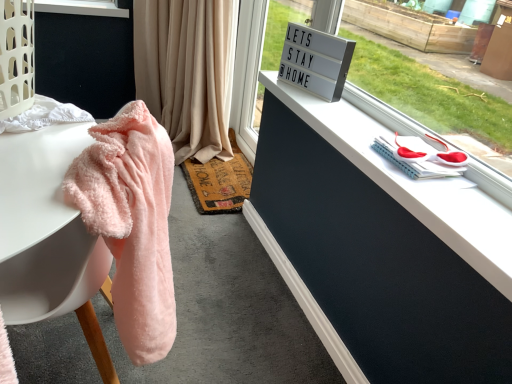
Question: Does white plastic sign at upper center lie in front of white matte dresser at upper right?

Choices:
 (A) yes
 (B) no

Answer: (B)

Question: Does white plastic sign at upper center appear on the right side of white matte dresser at upper right?

Choices:
 (A) yes
 (B) no

Answer: (B)

Question: Is white plastic sign at upper center wider than white matte dresser at upper right?

Choices:
 (A) yes
 (B) no

Answer: (B)

Question: From a real-world perspective, is white plastic sign at upper center positioned over white matte dresser at upper right based on gravity?

Choices:
 (A) yes
 (B) no

Answer: (B)

Question: Is white plastic sign at upper center next to white matte dresser at upper right and touching it?

Choices:
 (A) yes
 (B) no

Answer: (B)

Question: Can you confirm if white plastic sign at upper center is shorter than white matte dresser at upper right?

Choices:
 (A) no
 (B) yes

Answer: (A)

Question: From a real-world perspective, is white plastic sign at upper center positioned under rustic woven mat at center based on gravity?

Choices:
 (A) no
 (B) yes

Answer: (A)

Question: Can you confirm if white plastic sign at upper center is wider than rustic woven mat at center?

Choices:
 (A) yes
 (B) no

Answer: (B)

Question: Is white plastic sign at upper center oriented away from rustic woven mat at center?

Choices:
 (A) no
 (B) yes

Answer: (A)

Question: Is white plastic sign at upper center to the left of rustic woven mat at center from the viewer's perspective?

Choices:
 (A) yes
 (B) no

Answer: (B)

Question: Does white plastic sign at upper center come in front of rustic woven mat at center?

Choices:
 (A) no
 (B) yes

Answer: (B)

Question: Considering the relative sizes of white plastic sign at upper center and rustic woven mat at center in the image provided, is white plastic sign at upper center smaller than rustic woven mat at center?

Choices:
 (A) yes
 (B) no

Answer: (B)

Question: Is the depth of beige fabric curtain at upper center less than that of fluffy pink towel at left?

Choices:
 (A) no
 (B) yes

Answer: (A)